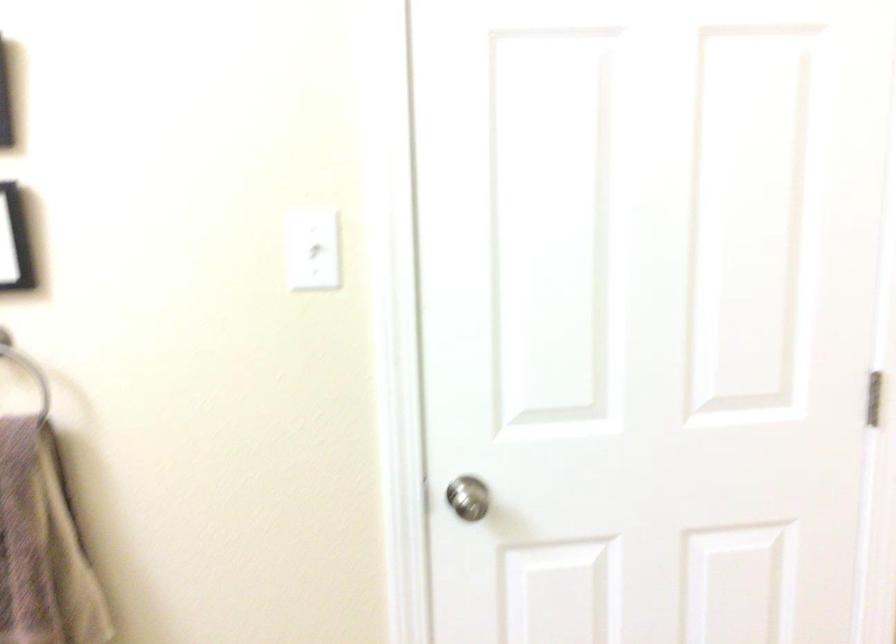
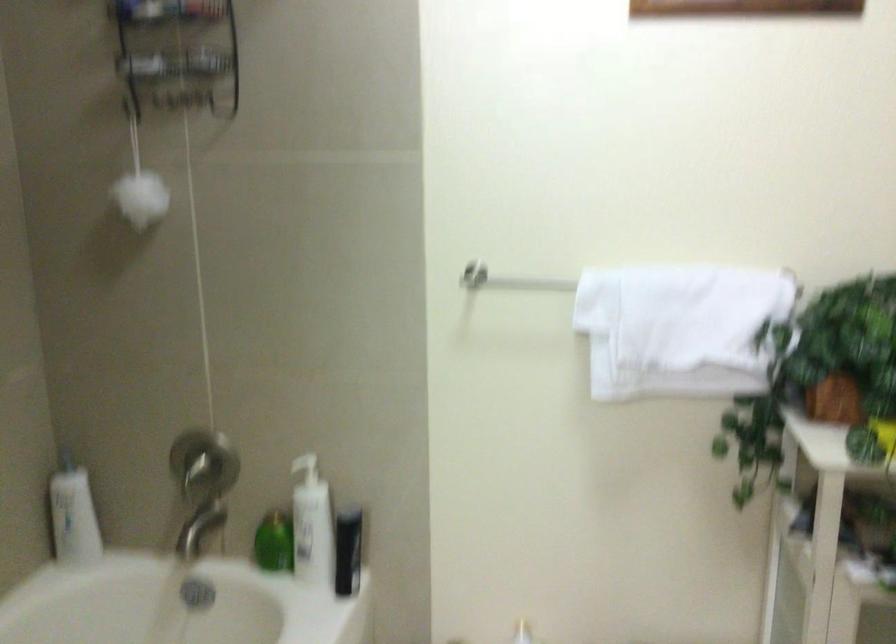
Question: The camera is either moving clockwise (left) or counter-clockwise (right) around the object. The first image is from the beginning of the video and the second image is from the end. Is the camera moving left or right when shooting the video?

Choices:
 (A) Left
 (B) Right

Answer: (A)